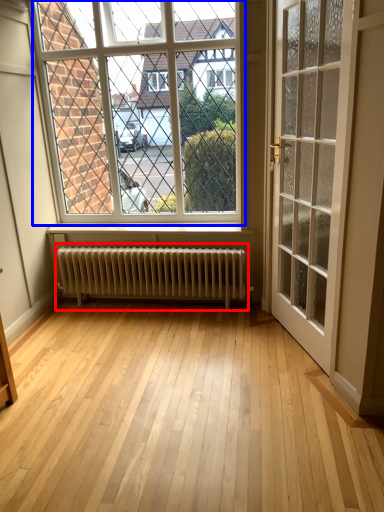
Question: Which object is further to the camera taking this photo, radiator (highlighted by a red box) or window (highlighted by a blue box)?

Choices:
 (A) radiator
 (B) window

Answer: (A)